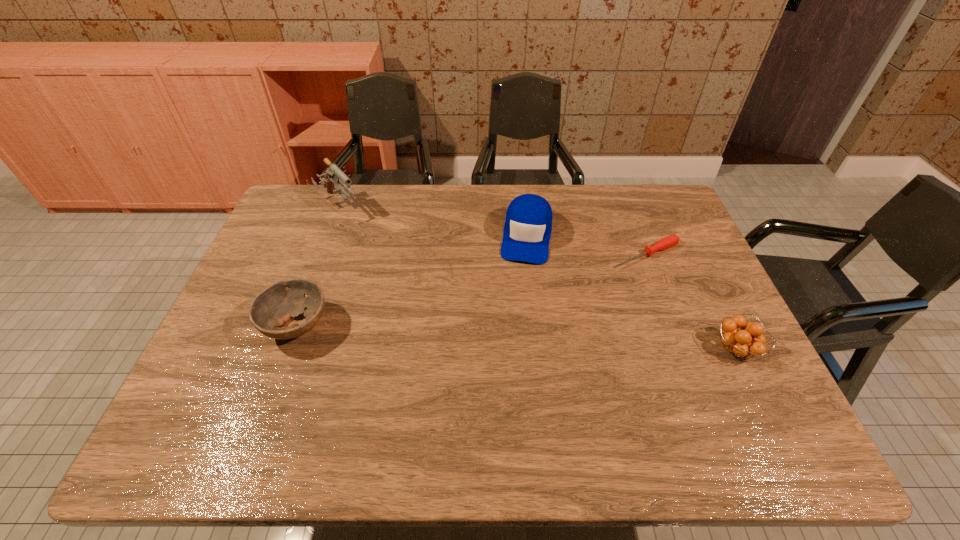
Select which object is the closest to the bowl. Please provide its 2D coordinates. Your answer should be formatted as a tuple, i.e. [(x, y)], where the tuple contains the x and y coordinates of a point satisfying the conditions above.

[(333, 174)]

Identify the location of object that stands as the fourth closest to the orange fruit. Image resolution: width=960 pixels, height=540 pixels. (333, 174).

Where is `vacant space that satisfies the following two spatial constraints: 1. on the front side of the bowl; 2. on the right side of the gun`? vacant space that satisfies the following two spatial constraints: 1. on the front side of the bowl; 2. on the right side of the gun is located at coordinates (296, 326).

Where is `vacant area that satisfies the following two spatial constraints: 1. on the back side of the bowl; 2. on the left side of the second tallest object`? This screenshot has width=960, height=540. vacant area that satisfies the following two spatial constraints: 1. on the back side of the bowl; 2. on the left side of the second tallest object is located at coordinates (329, 236).

Where is `vacant space that satisfies the following two spatial constraints: 1. on the front side of the shortest object; 2. on the left side of the tallest object`? vacant space that satisfies the following two spatial constraints: 1. on the front side of the shortest object; 2. on the left side of the tallest object is located at coordinates (322, 254).